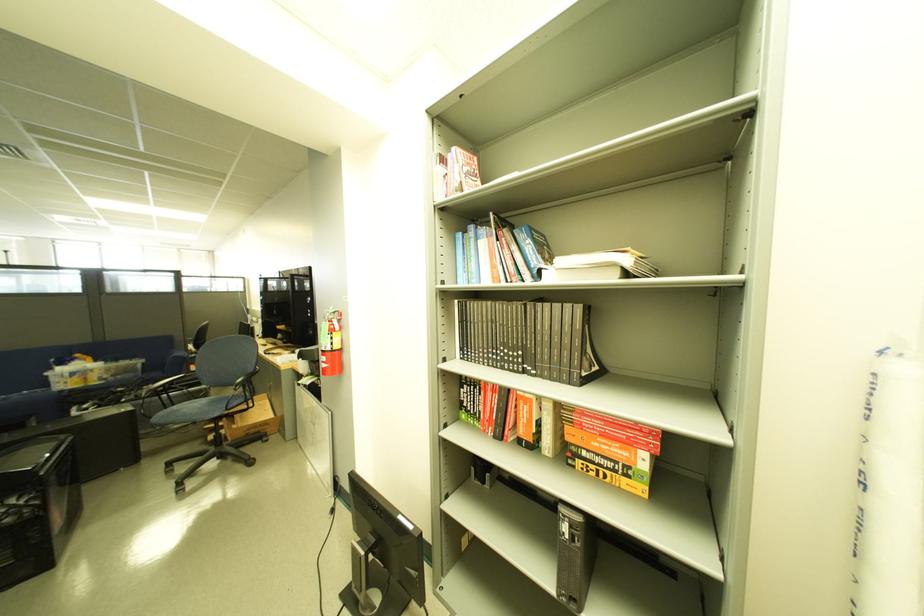
Find where to sit the blue chair sitting surface. Please return your answer as a coordinate pair (x, y).

(198, 410)